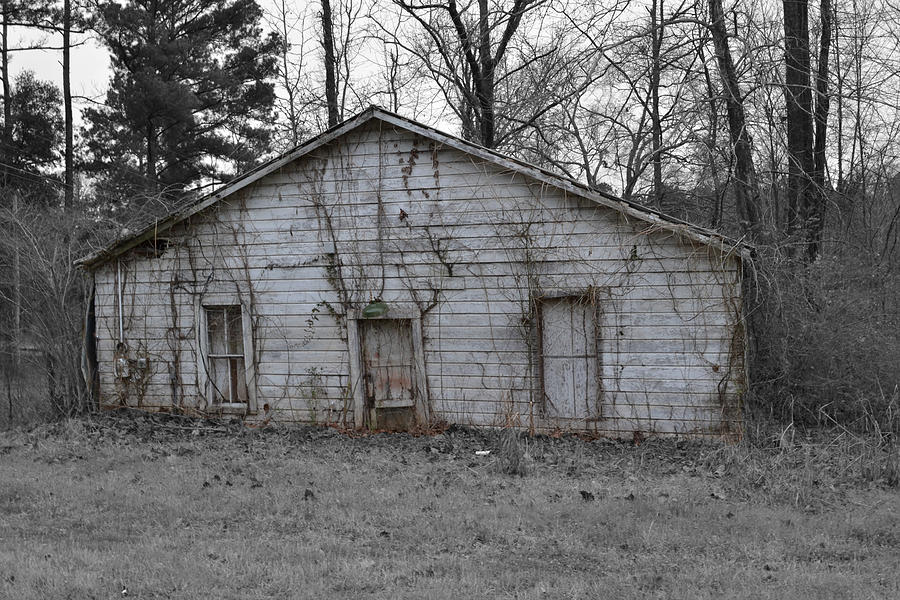
The height and width of the screenshot is (600, 900). In order to click on door in this screenshot , I will do `click(391, 334)`.